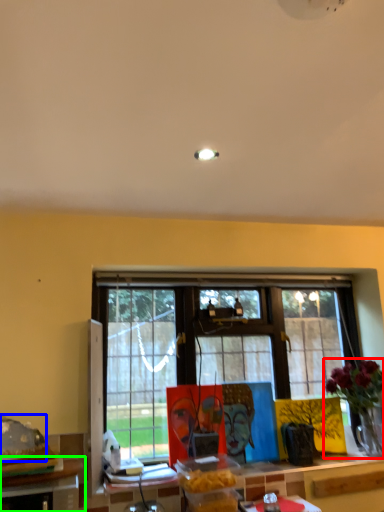
Question: Considering the real-world distances, which object is closest to houseplant (highlighted by a red box)? food (highlighted by a blue box) or table (highlighted by a green box).

Choices:
 (A) food
 (B) table

Answer: (B)